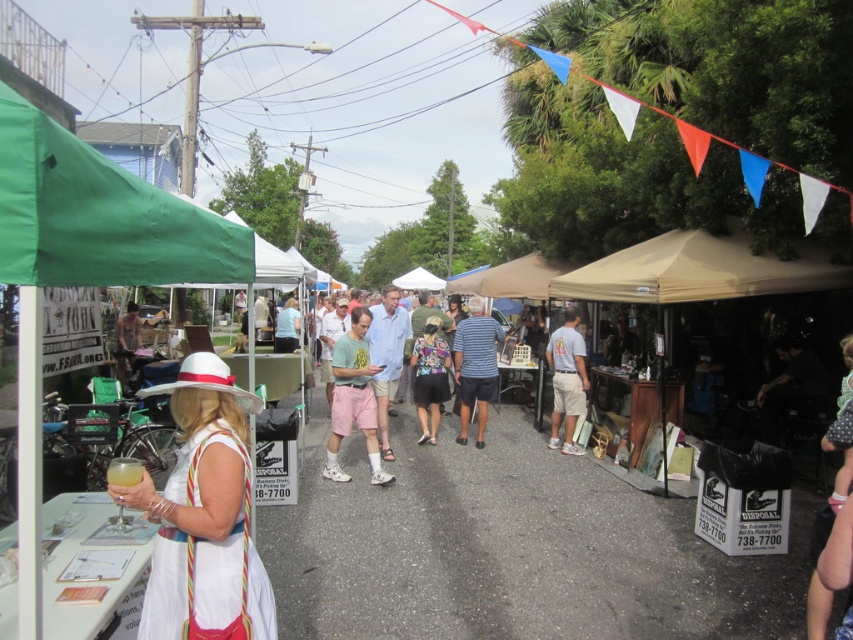
Between light blue t-shirt at center and floral-patterned fabric skirt at center, which one has less height?

floral-patterned fabric skirt at center is shorter.

Does light blue t-shirt at center have a lesser width compared to floral-patterned fabric skirt at center?

In fact, light blue t-shirt at center might be wider than floral-patterned fabric skirt at center.

Which is in front, point (570, 323) or point (428, 388)?

Point (428, 388) is more forward.

Find the location of a particular element. The width and height of the screenshot is (853, 640). light blue t-shirt at center is located at coordinates (566, 380).

Based on the photo, who is positioned more to the right, white cotton dress at center or floral-patterned fabric skirt at center?

From the viewer's perspective, floral-patterned fabric skirt at center appears more on the right side.

Which is behind, point (180, 618) or point (426, 384)?

The point (426, 384) is more distant.

Between point (236, 557) and point (415, 378), which one is positioned behind?

Positioned behind is point (415, 378).

Where is `white cotton dress at center`? The height and width of the screenshot is (640, 853). white cotton dress at center is located at coordinates (202, 513).

Between pink cotton shorts at center and light blue shirt at center, which one appears on the left side from the viewer's perspective?

Positioned to the left is light blue shirt at center.

Does pink cotton shorts at center come in front of light blue shirt at center?

Yes, pink cotton shorts at center is closer to the viewer.

Locate an element on the screen. pink cotton shorts at center is located at coordinates (352, 400).